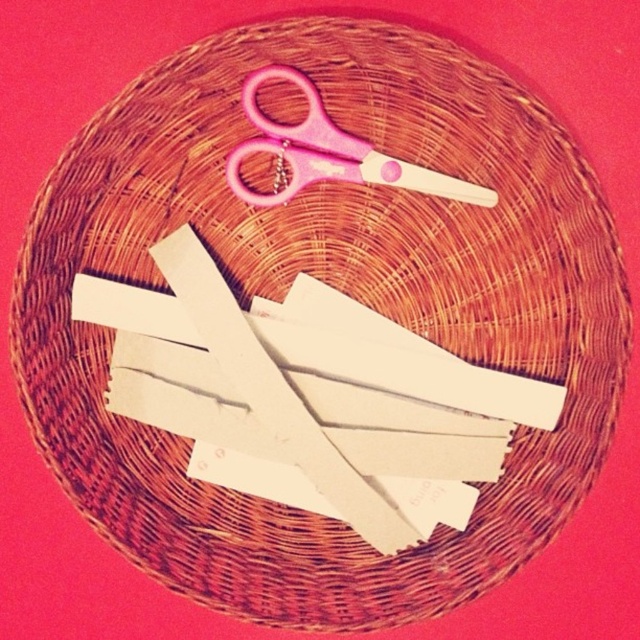
Is white paper at center further to the viewer compared to pink plastic scissors at upper center?

Yes, white paper at center is behind pink plastic scissors at upper center.

Who is shorter, white paper at center or pink plastic scissors at upper center?

pink plastic scissors at upper center

Between point (193, 292) and point (404, 164), which one is positioned behind?

Point (193, 292)

Locate an element on the screen. Image resolution: width=640 pixels, height=640 pixels. white paper at center is located at coordinates (307, 385).